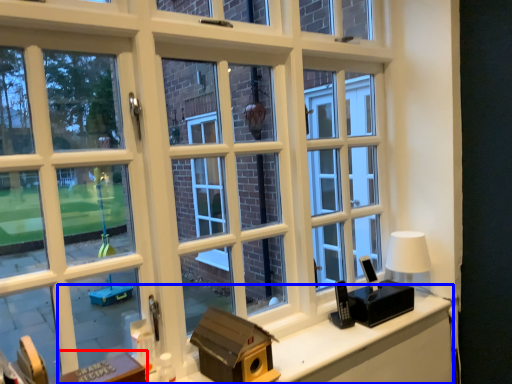
Question: Which point is further to the camera, table (highlighted by a red box) or computer desk (highlighted by a blue box)?

Choices:
 (A) table
 (B) computer desk

Answer: (B)